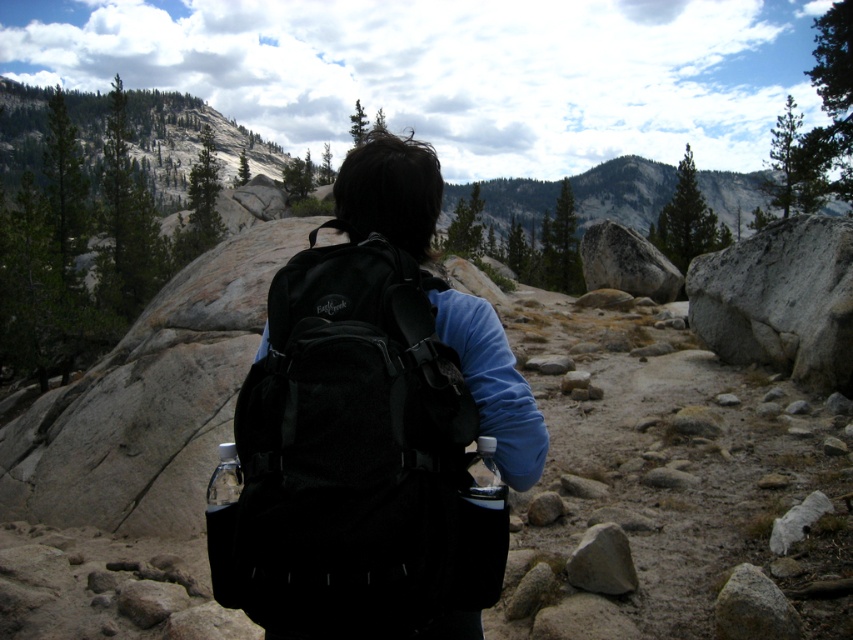
Question: Can you confirm if black mesh backpack at center is thinner than gray/rough rock at center?

Choices:
 (A) no
 (B) yes

Answer: (A)

Question: Can you confirm if black mesh backpack at center is positioned to the right of gray/rough rock at center?

Choices:
 (A) no
 (B) yes

Answer: (A)

Question: Which point appears farthest from the camera in this image?

Choices:
 (A) (776, 625)
 (B) (579, 561)

Answer: (B)

Question: Observing the image, what is the correct spatial positioning of black mesh backpack at center in reference to gray/rough rock at center?

Choices:
 (A) left
 (B) right

Answer: (A)

Question: Estimate the real-world distances between objects in this image. Which object is closer to the black mesh backpack at center?

Choices:
 (A) gray rock at lower right
 (B) gray/rough rock at center

Answer: (A)

Question: Which object is positioned closest to the gray/rough rock at center?

Choices:
 (A) black mesh backpack at center
 (B) gray rock at lower right

Answer: (B)